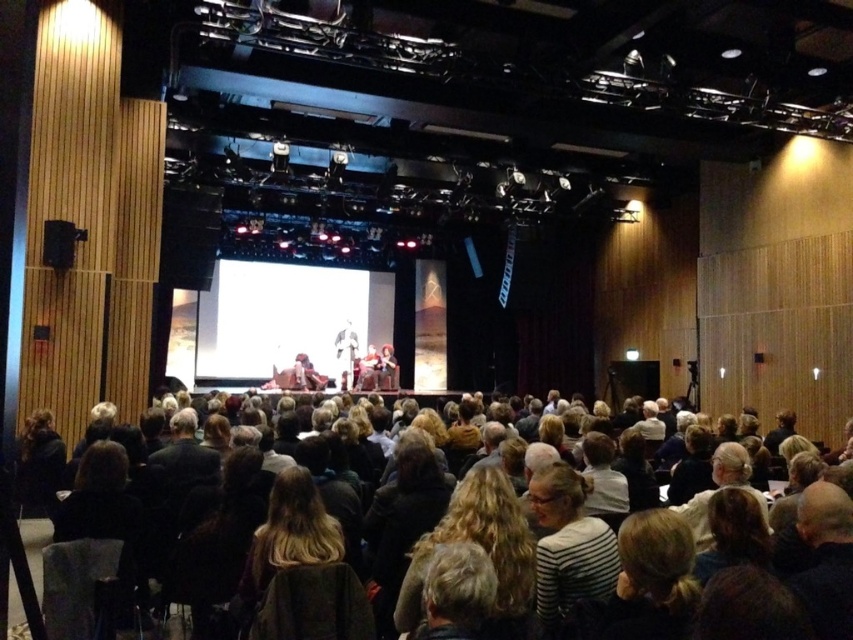
Question: Which point is closer to the camera?

Choices:
 (A) pos(642,436)
 (B) pos(548,568)

Answer: (B)

Question: Is striped cotton shirt at lower center in front of dark brown hair at lower center?

Choices:
 (A) yes
 (B) no

Answer: (A)

Question: Which point is farther to the camera?

Choices:
 (A) striped cotton shirt at lower center
 (B) dark brown hair at lower center

Answer: (B)

Question: Can you confirm if striped cotton shirt at lower center is smaller than dark brown hair at lower center?

Choices:
 (A) yes
 (B) no

Answer: (B)

Question: Is striped cotton shirt at lower center wider than dark brown hair at lower center?

Choices:
 (A) yes
 (B) no

Answer: (B)

Question: Which point appears closest to the camera in this image?

Choices:
 (A) (587, 540)
 (B) (779, 556)

Answer: (A)